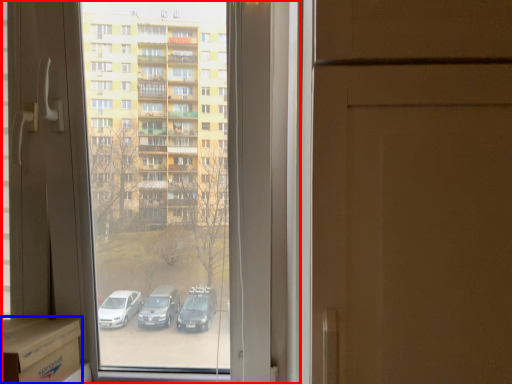
Question: Among these objects, which one is nearest to the camera, window (highlighted by a red box) or cardboard box (highlighted by a blue box)?

Choices:
 (A) window
 (B) cardboard box

Answer: (B)